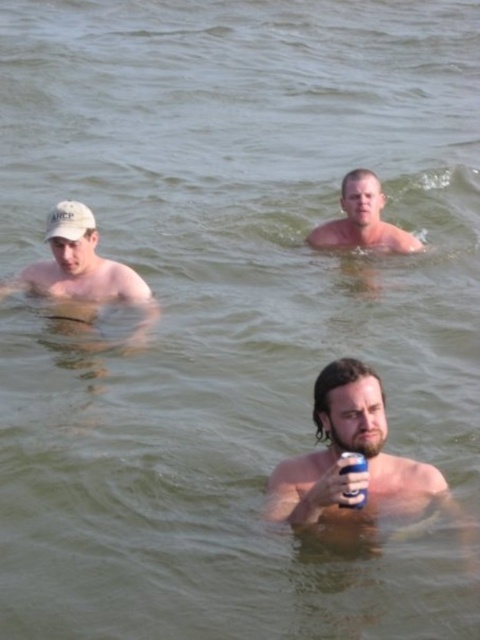
Question: Is white matte cap at left above blue metallic can at lower center?

Choices:
 (A) yes
 (B) no

Answer: (A)

Question: Which point appears farthest from the camera in this image?

Choices:
 (A) [x=357, y=452]
 (B) [x=357, y=182]
 (C) [x=94, y=268]
 (D) [x=408, y=490]

Answer: (B)

Question: Is bearded man at center in front of white matte cap at left?

Choices:
 (A) yes
 (B) no

Answer: (A)

Question: Is smooth skin man at center smaller than blue metallic can at lower center?

Choices:
 (A) yes
 (B) no

Answer: (B)

Question: Which object is farther from the camera taking this photo?

Choices:
 (A) smooth skin man at center
 (B) blue metallic can at lower center
 (C) white matte cap at left
 (D) bearded man at center

Answer: (A)

Question: Which point is closer to the camera?

Choices:
 (A) pos(362,464)
 (B) pos(379,192)

Answer: (A)